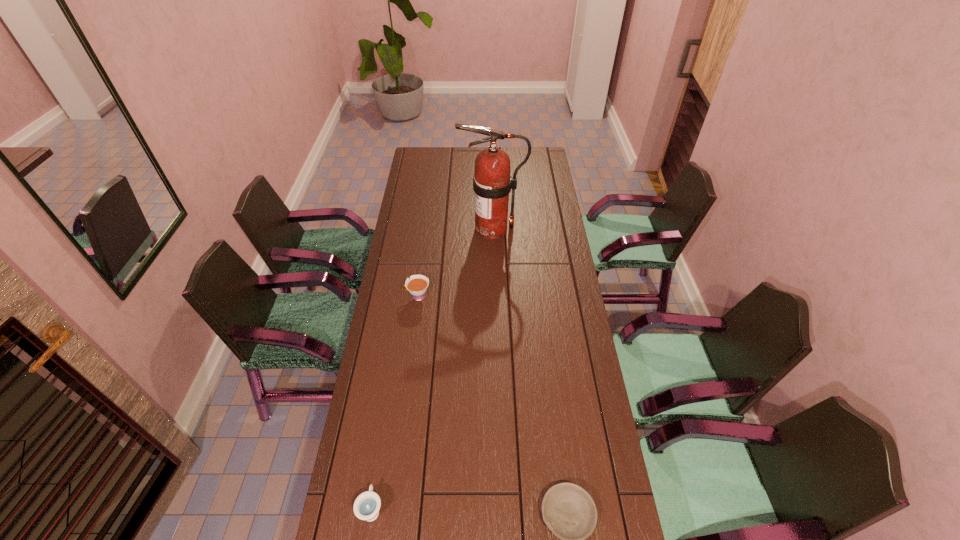
Image resolution: width=960 pixels, height=540 pixels. In order to click on the farthest object in this screenshot , I will do `click(492, 183)`.

Image resolution: width=960 pixels, height=540 pixels. I want to click on fire extinguisher, so click(492, 183).

Where is `the second tallest object`? The width and height of the screenshot is (960, 540). the second tallest object is located at coordinates (417, 285).

Identify the location of the farther teacup. (417, 285).

The image size is (960, 540). What are the coordinates of `the second shortest object` in the screenshot? It's located at (366, 507).

At what (x,y) coordinates should I click in order to perform the action: click on the shorter teacup. Please return your answer as a coordinate pair (x, y). Image resolution: width=960 pixels, height=540 pixels. Looking at the image, I should click on (366, 507).

Find the location of a particular element. free location located at the nozzle of the tallest object is located at coordinates (416, 229).

The width and height of the screenshot is (960, 540). Identify the location of free spot located 0.090m at the nozzle of the tallest object. (440, 229).

Find the location of `vacant space situated 0.070m at the nozzle of the tallest object`. vacant space situated 0.070m at the nozzle of the tallest object is located at coordinates (444, 229).

Locate an element on the screen. This screenshot has height=540, width=960. vacant region located on the side of the taller teacup with the handle is located at coordinates (389, 296).